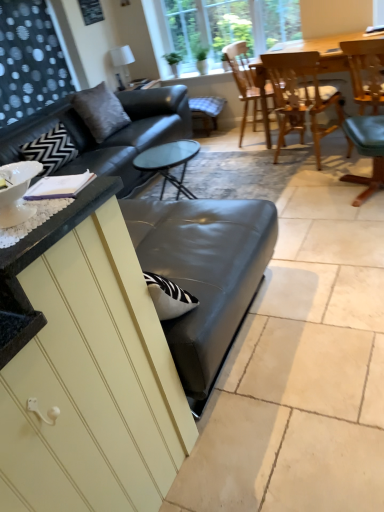
Question: Does checkered fabric bar stool at center have a lesser width compared to clear glass window at upper center?

Choices:
 (A) yes
 (B) no

Answer: (B)

Question: From a real-world perspective, is checkered fabric bar stool at center over clear glass window at upper center?

Choices:
 (A) yes
 (B) no

Answer: (B)

Question: Does checkered fabric bar stool at center turn towards clear glass window at upper center?

Choices:
 (A) no
 (B) yes

Answer: (A)

Question: Would you say checkered fabric bar stool at center is outside clear glass window at upper center?

Choices:
 (A) no
 (B) yes

Answer: (B)

Question: Does checkered fabric bar stool at center have a greater height compared to clear glass window at upper center?

Choices:
 (A) no
 (B) yes

Answer: (A)

Question: Would you say checkered fabric bar stool at center is to the left or to the right of wooden chair at upper right, marked as the first chair in a right-to-left arrangement, in the picture?

Choices:
 (A) left
 (B) right

Answer: (A)

Question: Relative to wooden chair at upper right, marked as the first chair in a right-to-left arrangement, is checkered fabric bar stool at center in front or behind?

Choices:
 (A) behind
 (B) front

Answer: (A)

Question: Is checkered fabric bar stool at center inside or outside of wooden chair at upper right, which ranks as the third chair in left-to-right order?

Choices:
 (A) outside
 (B) inside

Answer: (A)

Question: From their relative heights in the image, would you say checkered fabric bar stool at center is taller or shorter than wooden chair at upper right, marked as the first chair in a right-to-left arrangement?

Choices:
 (A) short
 (B) tall

Answer: (A)

Question: From a real-world perspective, is gray fabric pillow at upper left positioned above or below wooden chair at upper center, the first chair when ordered from left to right?

Choices:
 (A) below
 (B) above

Answer: (B)

Question: Which is correct: gray fabric pillow at upper left is inside wooden chair at upper center, which is the third chair in right-to-left order, or outside of it?

Choices:
 (A) inside
 (B) outside

Answer: (B)

Question: Based on their sizes in the image, would you say gray fabric pillow at upper left is bigger or smaller than wooden chair at upper center, the first chair when ordered from left to right?

Choices:
 (A) big
 (B) small

Answer: (B)

Question: From the image's perspective, is gray fabric pillow at upper left positioned above or below wooden chair at upper center, which is the third chair in right-to-left order?

Choices:
 (A) above
 (B) below

Answer: (B)

Question: Which is correct: wooden chair at upper right, which ranks as the third chair in left-to-right order, is inside wooden chair at upper right, which is the 2th chair from right to left, or outside of it?

Choices:
 (A) inside
 (B) outside

Answer: (B)

Question: Based on their positions, is wooden chair at upper right, which ranks as the third chair in left-to-right order, located to the left or right of wooden chair at upper right, which is counted as the 2th chair, starting from the left?

Choices:
 (A) left
 (B) right

Answer: (B)